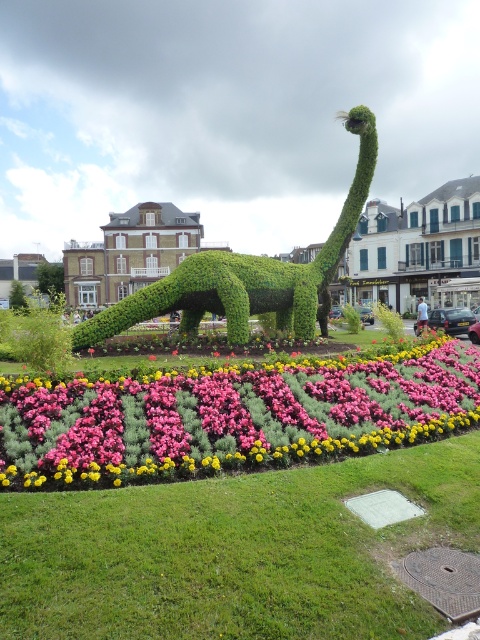
Who is more distant from viewer, (107,449) or (268,282)?

Positioned behind is point (268,282).

Based on the photo, which is above, pink matte flowers at center or green leafy plant at center?

green leafy plant at center is higher up.

This screenshot has height=640, width=480. Identify the location of pink matte flowers at center. (230, 419).